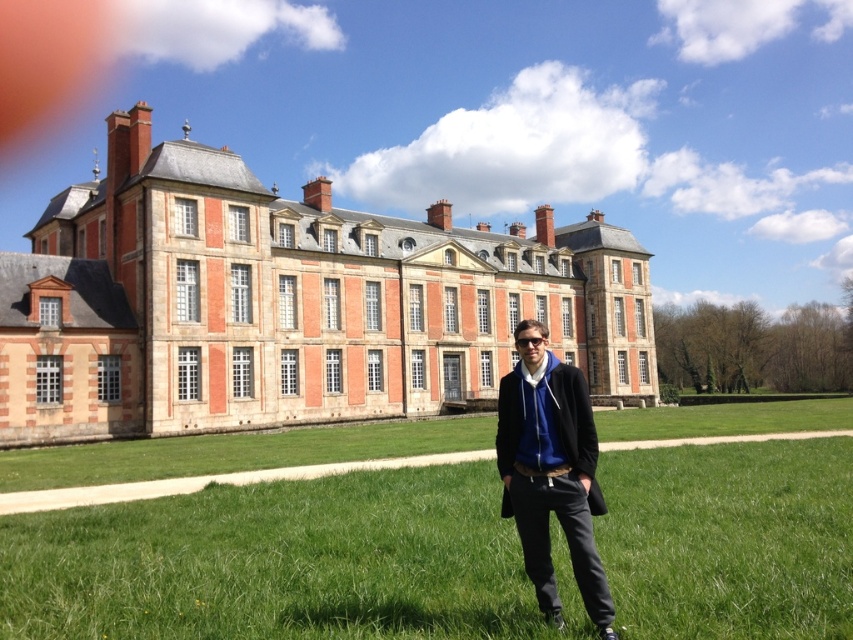
Question: Which point appears closest to the camera in this image?

Choices:
 (A) (718, 422)
 (B) (473, 323)
 (C) (573, 438)

Answer: (C)

Question: Does brick stone palace at center appear on the right side of blue fleece jacket at center?

Choices:
 (A) yes
 (B) no

Answer: (B)

Question: Can you confirm if green grass at center is positioned to the left of blue fleece jacket at center?

Choices:
 (A) yes
 (B) no

Answer: (A)

Question: Among these objects, which one is nearest to the camera?

Choices:
 (A) brick stone palace at center
 (B) blue fleece jacket at center
 (C) green grass at center

Answer: (C)

Question: Does brick stone palace at center come in front of blue fleece jacket at center?

Choices:
 (A) no
 (B) yes

Answer: (A)

Question: Based on their relative distances, which object is nearer to the green grass at center?

Choices:
 (A) blue fleece jacket at center
 (B) brick stone palace at center

Answer: (A)